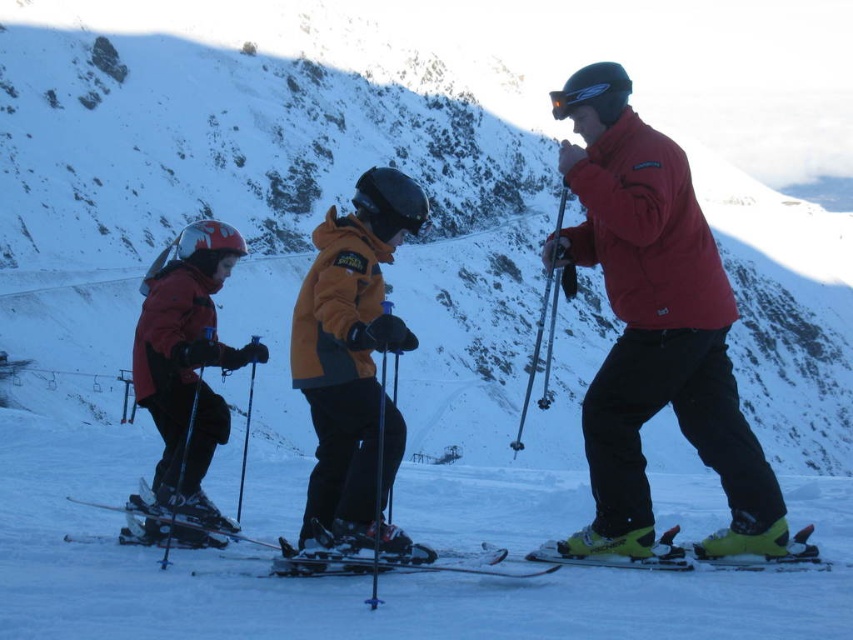
Does matte black ski suit at left lie in front of matte black skis at center?

Yes.

Which of these two, matte black ski suit at left or matte black skis at center, stands taller?

Standing taller between the two is matte black ski suit at left.

From the picture: Measure the distance between point (195, 403) and camera.

Point (195, 403) and camera are 37.40 meters apart.

Where is `matte black ski suit at left`? The image size is (853, 640). matte black ski suit at left is located at coordinates (186, 365).

Does point (207, 220) come closer to viewer compared to point (798, 552)?

No, it is behind (798, 552).

Between matte black ski suit at left and yellow-green plastic ski at lower center, which one has less height?

yellow-green plastic ski at lower center is shorter.

The image size is (853, 640). I want to click on matte black ski suit at left, so click(x=186, y=365).

Who is higher up, matte black ski suit at left or shiny black ski at center?

matte black ski suit at left is higher up.

Is matte black ski suit at left below shiny black ski at center?

No, matte black ski suit at left is not below shiny black ski at center.

Who is more distant from viewer, (148, 356) or (316, 572)?

The point (148, 356) is more distant.

Identify the location of matte black ski suit at left. The image size is (853, 640). (186, 365).